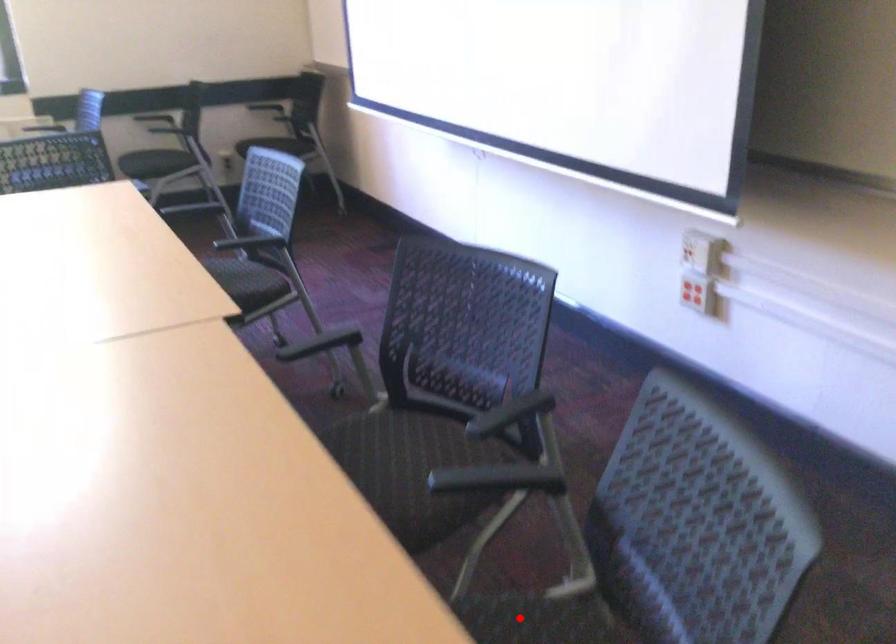
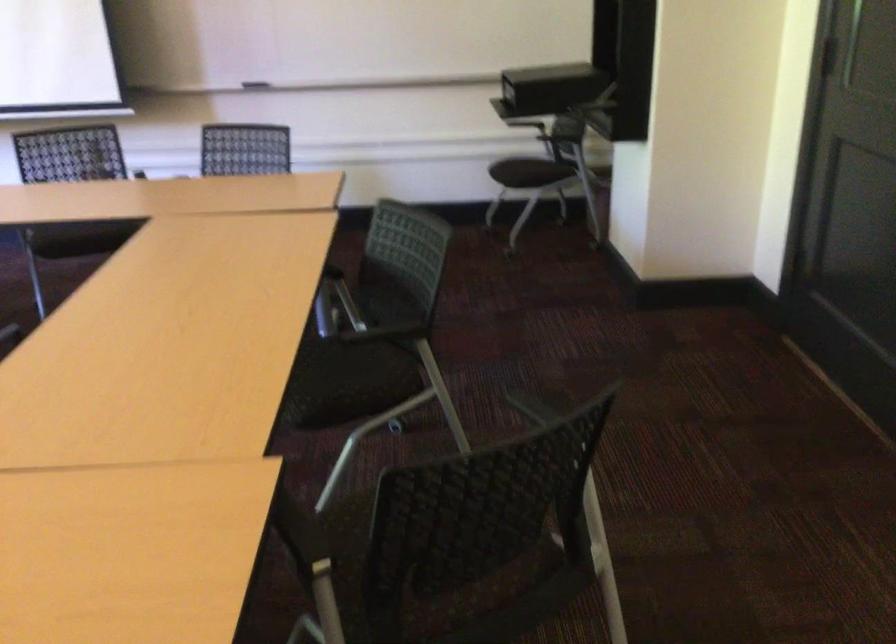
Question: I am providing you with two images of the same scene from different viewpoints. A red point is marked on the first image. Is the red point's position out of view in image 2?

Choices:
 (A) Yes
 (B) No

Answer: (A)